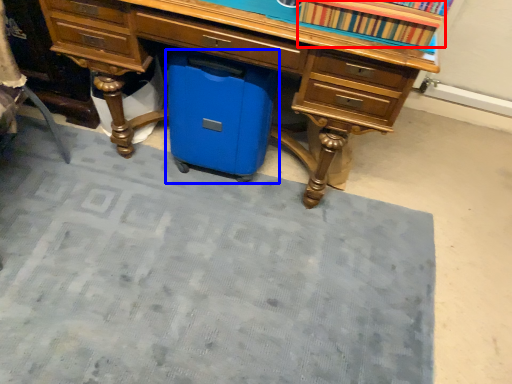
Question: Which point is closer to the camera, book (highlighted by a red box) or cooler (highlighted by a blue box)?

Choices:
 (A) book
 (B) cooler

Answer: (A)